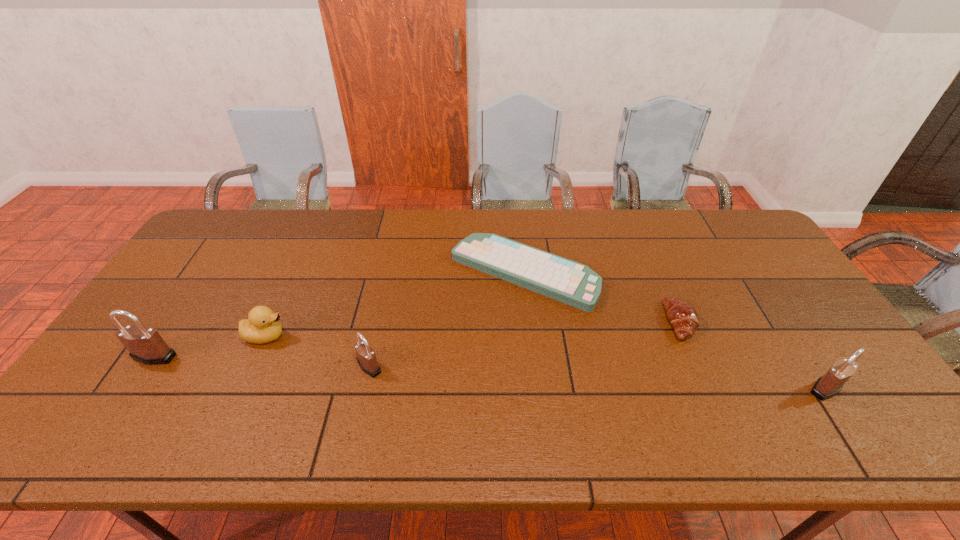
This screenshot has width=960, height=540. I want to click on the leftmost padlock, so click(x=145, y=344).

Locate an element on the screen. Image resolution: width=960 pixels, height=540 pixels. the third object from left to right is located at coordinates (366, 358).

Find the location of a particular element. the second padlock from right to left is located at coordinates (366, 358).

Find the location of `the second tallest object`. the second tallest object is located at coordinates (829, 385).

This screenshot has width=960, height=540. In order to click on the rightmost padlock in this screenshot , I will do `click(829, 385)`.

What are the coordinates of `the shortest object` in the screenshot? It's located at (567, 281).

In order to click on the third object from right to left in this screenshot , I will do `click(567, 281)`.

The height and width of the screenshot is (540, 960). I want to click on the second object from right to left, so click(x=681, y=314).

Locate an element on the screen. This screenshot has width=960, height=540. crescent roll is located at coordinates (681, 314).

Locate an element on the screen. The width and height of the screenshot is (960, 540). duckling is located at coordinates (262, 326).